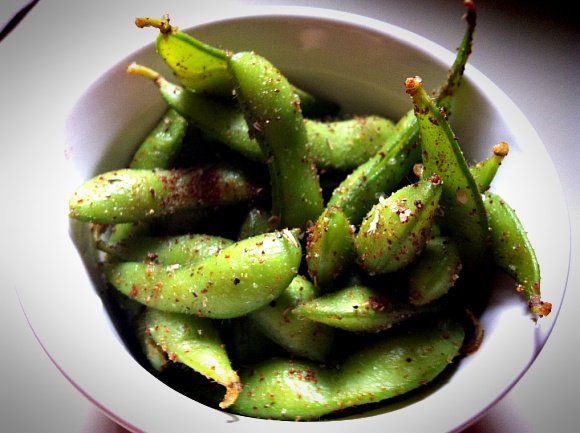
Locate an element on the screen. bowl rim is located at coordinates (79, 350).